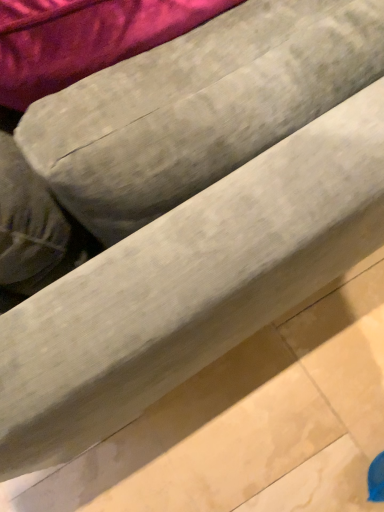
Question: From a real-world perspective, is beige marble tile at lower right beneath textured gray bean bag at center?

Choices:
 (A) yes
 (B) no

Answer: (A)

Question: Can you confirm if beige marble tile at lower right is wider than textured gray bean bag at center?

Choices:
 (A) yes
 (B) no

Answer: (A)

Question: Considering the relative positions of beige marble tile at lower right and textured gray bean bag at center in the image provided, is beige marble tile at lower right in front of textured gray bean bag at center?

Choices:
 (A) no
 (B) yes

Answer: (A)

Question: Is beige marble tile at lower right with textured gray bean bag at center?

Choices:
 (A) yes
 (B) no

Answer: (B)

Question: Considering the relative sizes of beige marble tile at lower right and textured gray bean bag at center in the image provided, is beige marble tile at lower right shorter than textured gray bean bag at center?

Choices:
 (A) yes
 (B) no

Answer: (A)

Question: From a real-world perspective, is beige marble tile at lower right physically above textured gray bean bag at center?

Choices:
 (A) yes
 (B) no

Answer: (B)

Question: Does textured gray bean bag at center come behind beige marble tile at lower right?

Choices:
 (A) no
 (B) yes

Answer: (A)

Question: Is textured gray bean bag at center to the right of beige marble tile at lower right from the viewer's perspective?

Choices:
 (A) yes
 (B) no

Answer: (B)

Question: Considering the relative sizes of textured gray bean bag at center and beige marble tile at lower right in the image provided, is textured gray bean bag at center smaller than beige marble tile at lower right?

Choices:
 (A) no
 (B) yes

Answer: (A)

Question: Can beige marble tile at lower right be found inside textured gray bean bag at center?

Choices:
 (A) no
 (B) yes

Answer: (A)

Question: Does textured gray bean bag at center have a greater height compared to beige marble tile at lower right?

Choices:
 (A) no
 (B) yes

Answer: (B)

Question: Does textured gray bean bag at center appear on the left side of beige marble tile at lower right?

Choices:
 (A) yes
 (B) no

Answer: (A)

Question: Do you think textured gray bean bag at center is within beige marble tile at lower right, or outside of it?

Choices:
 (A) inside
 (B) outside

Answer: (B)